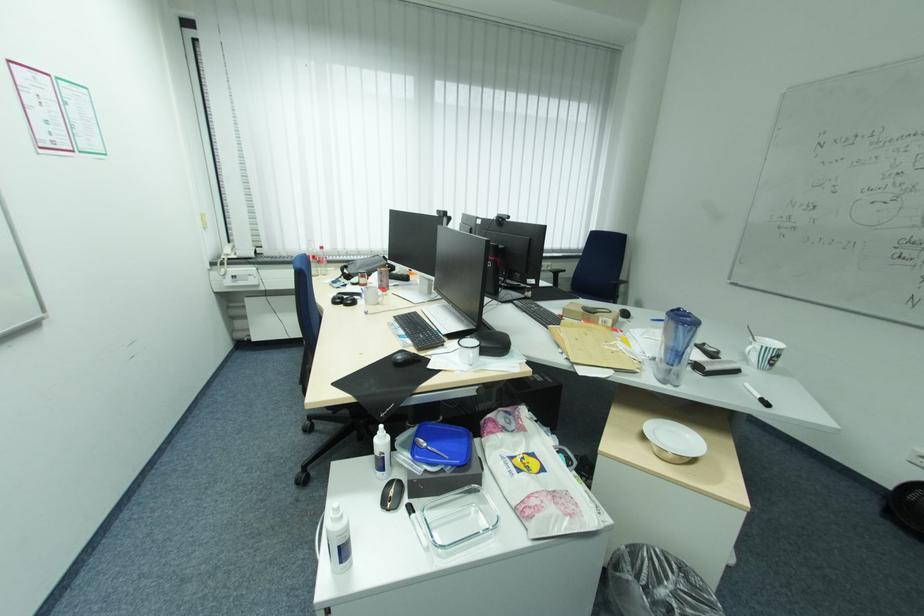
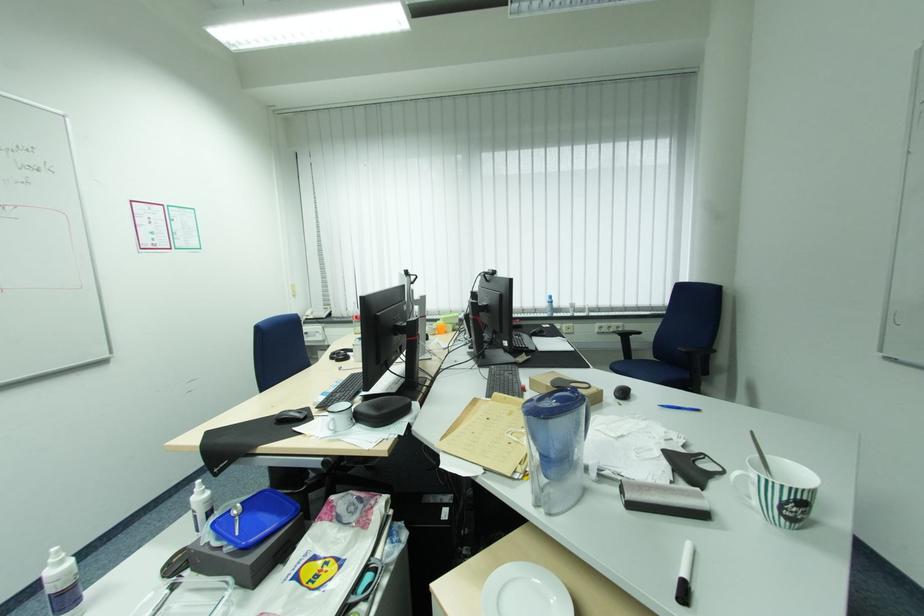
Find the pixel in the second image that matches [479,354] in the first image.

(339, 419)